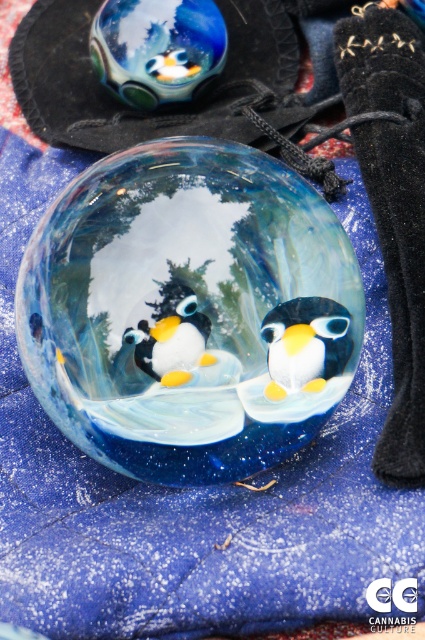
Is transparent glass bowl at center thinner than matte glass penguin at center?

In fact, transparent glass bowl at center might be wider than matte glass penguin at center.

Can you confirm if transparent glass bowl at center is positioned to the left of matte glass penguin at center?

No, transparent glass bowl at center is not to the left of matte glass penguin at center.

Which is in front, point (98, 307) or point (155, 380)?

Point (155, 380) is more forward.

I want to click on transparent glass bowl at center, so click(x=189, y=310).

Can you confirm if shiny glass penguin at center is thinner than matte glass penguin at center?

No, shiny glass penguin at center is not thinner than matte glass penguin at center.

Locate an element on the screen. shiny glass penguin at center is located at coordinates (306, 344).

Does point (254, 445) lie in front of point (303, 368)?

No, (254, 445) is further to viewer.

Is transparent glass bowl at center bigger than shiny glass penguin at center?

Indeed, transparent glass bowl at center has a larger size compared to shiny glass penguin at center.

This screenshot has height=640, width=425. What do you see at coordinates (189, 310) in the screenshot? I see `transparent glass bowl at center` at bounding box center [189, 310].

Identify the location of transparent glass bowl at center. The height and width of the screenshot is (640, 425). (189, 310).